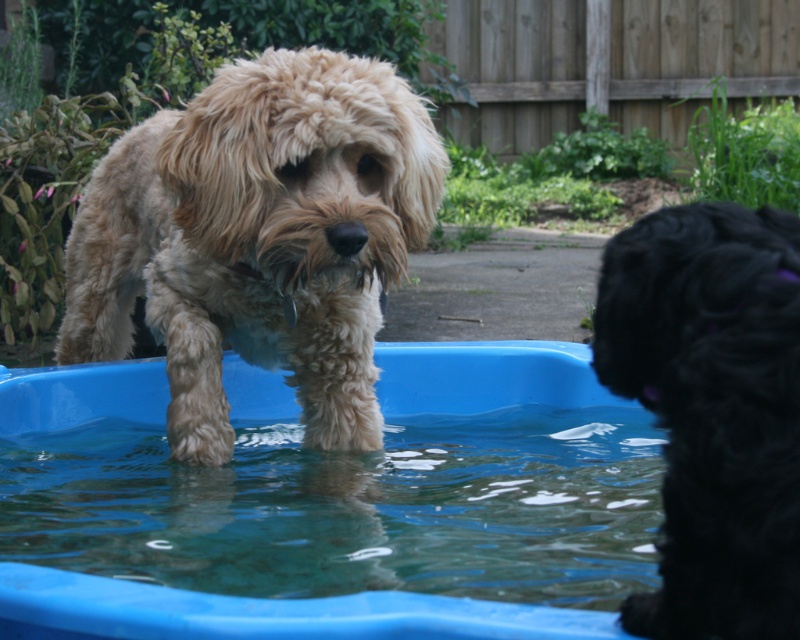
Does point (216, 420) come farther from viewer compared to point (225, 612)?

Yes, point (216, 420) is farther from viewer.

Between fuzzy beige dog at center and clear plastic water at center, which one is positioned higher?

Positioned higher is fuzzy beige dog at center.

Is point (260, 64) farther from camera compared to point (242, 413)?

No, it is in front of (242, 413).

Find the location of a particular element. The width and height of the screenshot is (800, 640). fuzzy beige dog at center is located at coordinates (258, 240).

Can you confirm if black fuzzy dog at right is positioned to the left of clear plastic water at center?

No, black fuzzy dog at right is not to the left of clear plastic water at center.

Which is more to the left, black fuzzy dog at right or clear plastic water at center?

From the viewer's perspective, clear plastic water at center appears more on the left side.

Does point (756, 424) come farther from viewer compared to point (40, 380)?

That is False.

Where is `black fuzzy dog at right`? The image size is (800, 640). black fuzzy dog at right is located at coordinates (712, 410).

Is point (274, 296) closer to camera compared to point (682, 291)?

No, it is not.

The image size is (800, 640). What do you see at coordinates (258, 240) in the screenshot?
I see `fuzzy beige dog at center` at bounding box center [258, 240].

Where is `fuzzy beige dog at center`? The width and height of the screenshot is (800, 640). fuzzy beige dog at center is located at coordinates (258, 240).